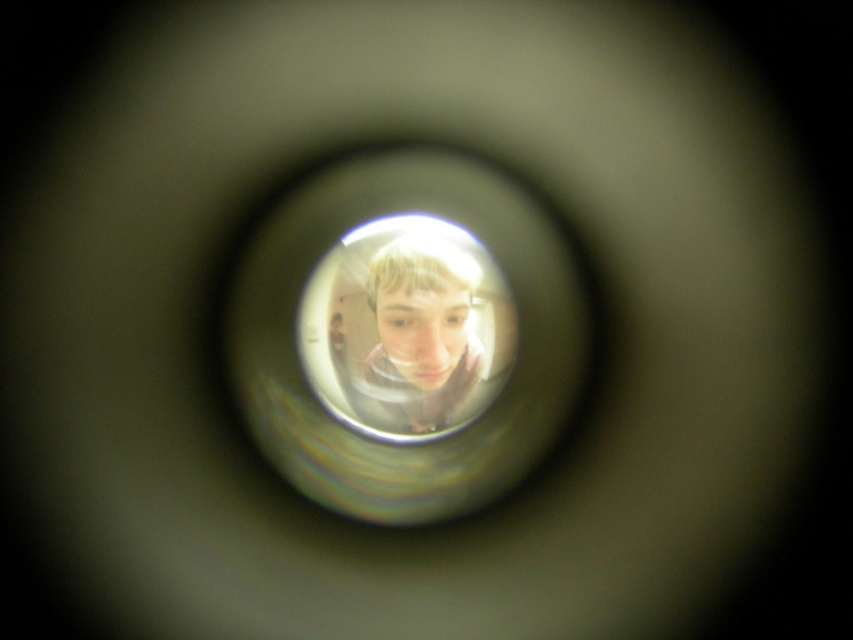
Does transparent glass lens at center appear over transparent plastic lens at center?

Actually, transparent glass lens at center is below transparent plastic lens at center.

This screenshot has width=853, height=640. Describe the element at coordinates (405, 336) in the screenshot. I see `transparent glass lens at center` at that location.

Locate an element on the screen. This screenshot has width=853, height=640. transparent glass lens at center is located at coordinates tap(405, 336).

The width and height of the screenshot is (853, 640). Identify the location of transparent glass lens at center. (405, 336).

Does transparent glass lens at center have a lesser width compared to smooth skin face at center?

Incorrect, transparent glass lens at center's width is not less than smooth skin face at center's.

Who is higher up, transparent glass lens at center or smooth skin face at center?

smooth skin face at center is higher up.

Describe the element at coordinates (405, 336) in the screenshot. I see `transparent glass lens at center` at that location.

At what (x,y) coordinates should I click in order to perform the action: click on transparent glass lens at center. Please return your answer as a coordinate pair (x, y). Looking at the image, I should click on (405, 336).

Is point (405, 368) positioned after point (445, 300)?

Yes, point (405, 368) is farther from viewer.

Is transparent plastic lens at center smaller than smooth skin face at center?

No, transparent plastic lens at center is not smaller than smooth skin face at center.

Who is more forward, (351, 348) or (405, 285)?

Point (405, 285) is in front.

Find the location of a particular element. This screenshot has height=640, width=853. transparent plastic lens at center is located at coordinates (405, 326).